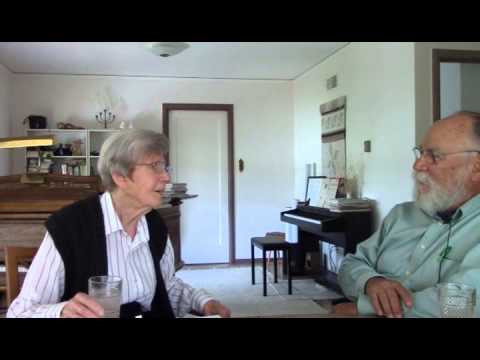
The width and height of the screenshot is (480, 360). What are the coordinates of `wall` in the screenshot? It's located at coord(275,144), coord(387,104), coord(423,76), coord(3,95).